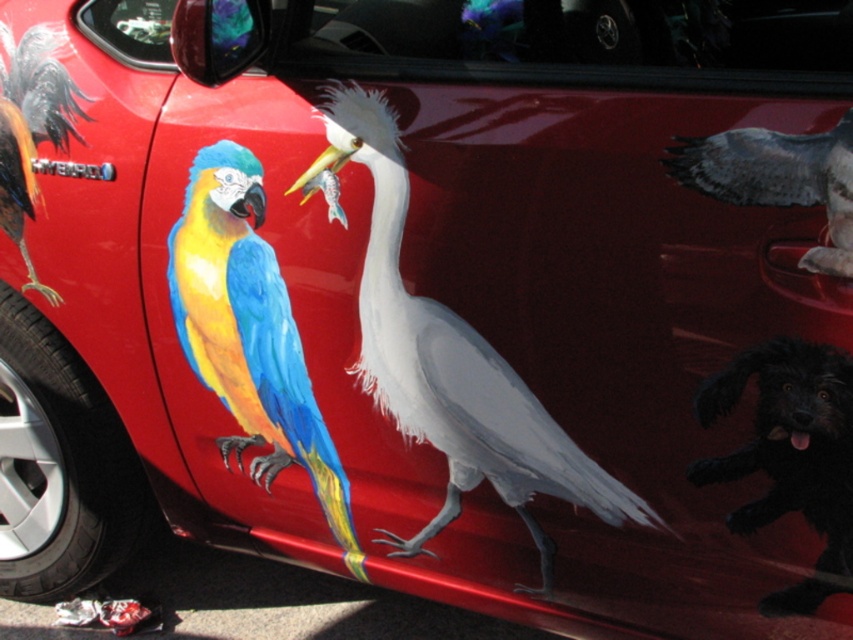
Does shiny multicolored parrot at left appear over speckled feathered bird at upper right?

Actually, shiny multicolored parrot at left is below speckled feathered bird at upper right.

Which is in front, point (172, 307) or point (817, 140)?

Point (817, 140) is in front.

Describe the element at coordinates (248, 333) in the screenshot. I see `shiny multicolored parrot at left` at that location.

I want to click on shiny multicolored parrot at left, so click(248, 333).

Describe the element at coordinates (778, 179) in the screenshot. I see `speckled feathered bird at upper right` at that location.

Who is lower down, speckled feathered bird at upper right or shiny metallic rooster at upper left?

speckled feathered bird at upper right

Is point (726, 173) behind point (9, 221)?

No, (726, 173) is closer to viewer.

You are a GUI agent. You are given a task and a screenshot of the screen. Output one action in this format:
    pyautogui.click(x=<x>, y=<y>)
    Task: Click on the speckled feathered bird at upper right
    
    Given the screenshot: What is the action you would take?
    pyautogui.click(x=778, y=179)

Is white matte bird at center bigger than shiny metallic rooster at upper left?

Yes, white matte bird at center is bigger than shiny metallic rooster at upper left.

Is white matte bird at center taller than shiny metallic rooster at upper left?

Correct, white matte bird at center is much taller as shiny metallic rooster at upper left.

The height and width of the screenshot is (640, 853). What do you see at coordinates (450, 362) in the screenshot?
I see `white matte bird at center` at bounding box center [450, 362].

What are the coordinates of `white matte bird at center` in the screenshot? It's located at (450, 362).